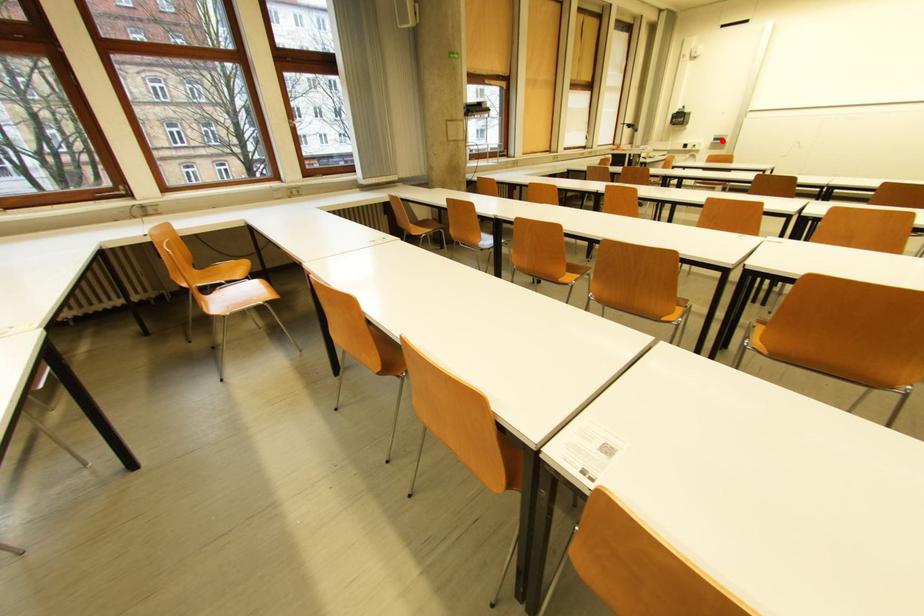
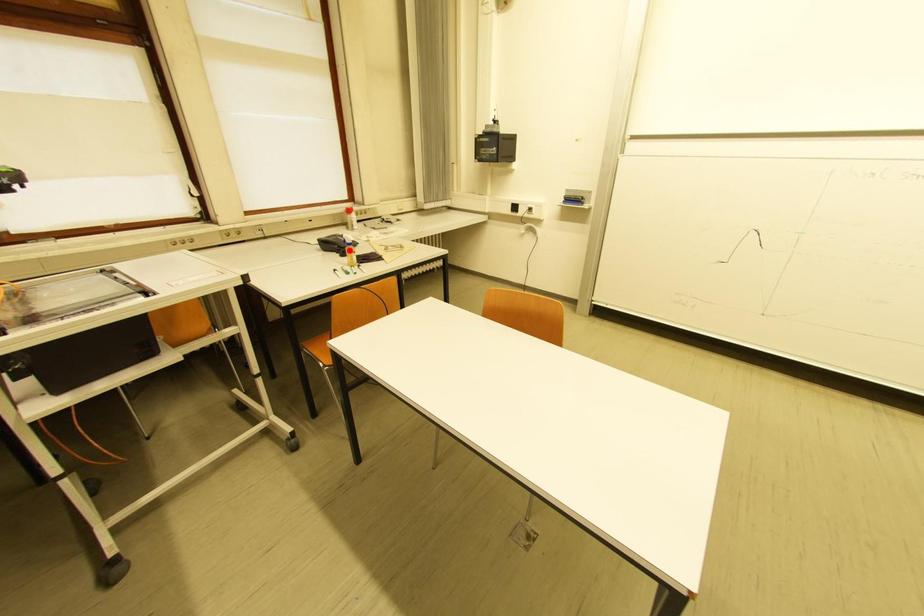
I am providing you with two images of the same scene from different viewpoints. A red point is marked on the first image and another point is marked on the second image. Is the marked point in image1 the same physical position as the marked point in image2?

No